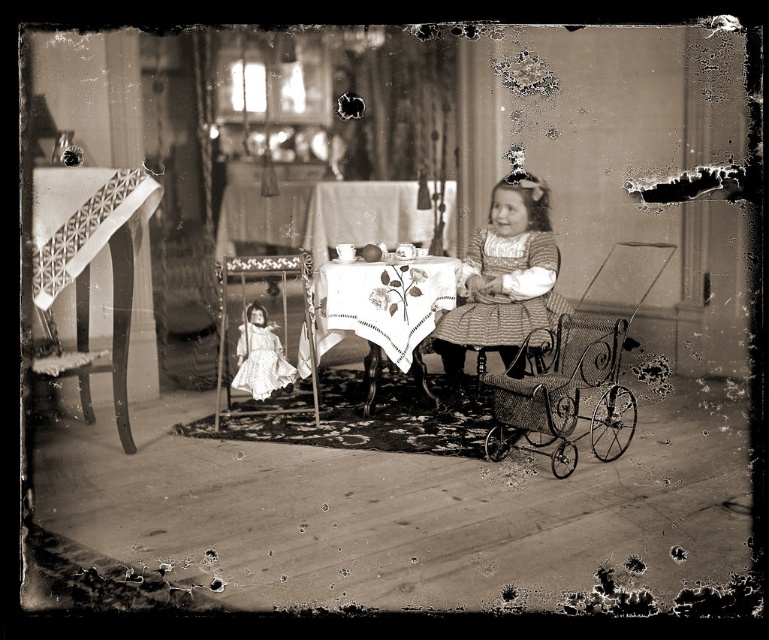
Question: Where is white woven fabric at left located in relation to striped fabric dress at center in the image?

Choices:
 (A) left
 (B) right

Answer: (A)

Question: Which point is closer to the camera?

Choices:
 (A) (463, 282)
 (B) (528, 429)
 (C) (370, 387)
 (D) (78, 321)

Answer: (B)

Question: Is white woven fabric at left below white satin doll at center?

Choices:
 (A) yes
 (B) no

Answer: (B)

Question: Which object appears farthest from the camera in this image?

Choices:
 (A) white satin doll at center
 (B) white woven fabric at left
 (C) matte wooden chair at center

Answer: (A)

Question: Is striped fabric dress at center positioned before white satin doll at center?

Choices:
 (A) yes
 (B) no

Answer: (A)

Question: Which of the following is the farthest from the observer?

Choices:
 (A) white woven fabric at left
 (B) matte wooden chair at center

Answer: (B)